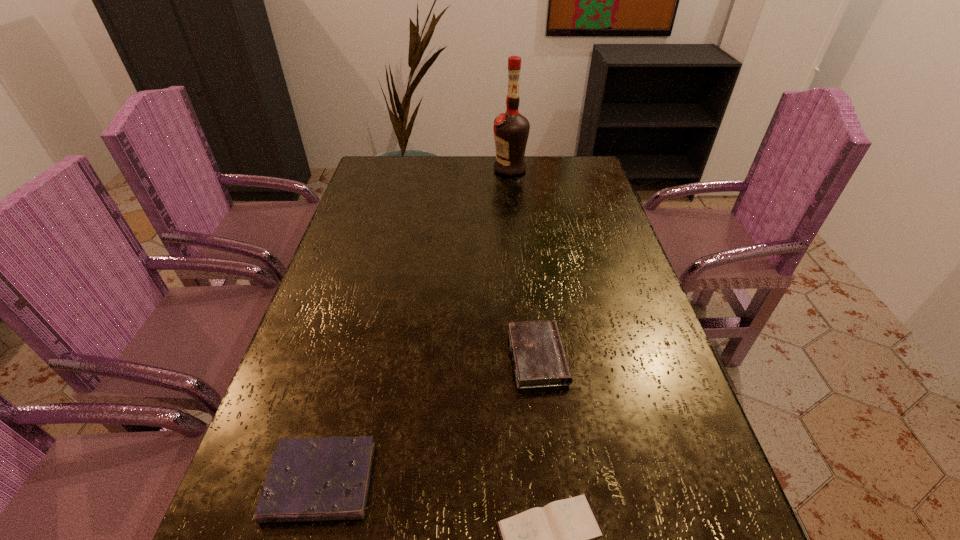
This screenshot has width=960, height=540. I want to click on the farthest object, so click(x=511, y=129).

You are a GUI agent. You are given a task and a screenshot of the screen. Output one action in this format:
    pyautogui.click(x=<x>, y=<y>)
    Task: Click on the tallest object
    The height and width of the screenshot is (540, 960).
    Given the screenshot: What is the action you would take?
    pyautogui.click(x=511, y=129)

Where is `the tallest diary`? the tallest diary is located at coordinates (539, 358).

The width and height of the screenshot is (960, 540). In order to click on the second farthest object in this screenshot , I will do `click(539, 358)`.

Where is `the third tallest object`? Image resolution: width=960 pixels, height=540 pixels. the third tallest object is located at coordinates (310, 479).

Where is `the leftmost diary`? The width and height of the screenshot is (960, 540). the leftmost diary is located at coordinates (310, 479).

You are a GUI agent. You are given a task and a screenshot of the screen. Output one action in this format:
    pyautogui.click(x=<x>, y=<y>)
    Task: Click on the free space located 0.160m on the front and back of the farthest object
    The image size is (960, 540).
    Given the screenshot: What is the action you would take?
    pyautogui.click(x=448, y=169)

Where is `blank space located on the front and back of the farthest object`? This screenshot has height=540, width=960. blank space located on the front and back of the farthest object is located at coordinates (432, 169).

The width and height of the screenshot is (960, 540). Find the location of `free space located on the front and back of the farthest object`. free space located on the front and back of the farthest object is located at coordinates (445, 169).

Locate an element on the screen. The width and height of the screenshot is (960, 540). vacant space located on the front of the third nearest object is located at coordinates (545, 421).